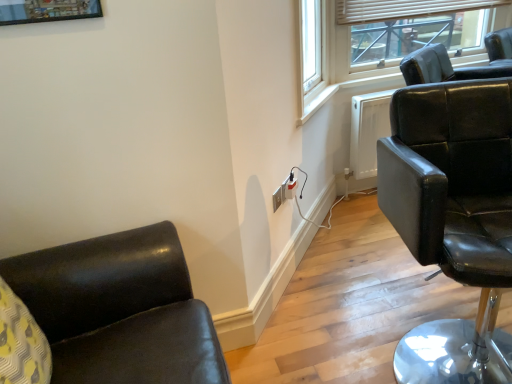
Find the location of `matte black chair at upper right`. matte black chair at upper right is located at coordinates (412, 29).

Describe the element at coordinates (412, 29) in the screenshot. I see `matte black chair at upper right` at that location.

In the scene shown: Measure the distance between matte black chair at right and camera.

A distance of 38.92 inches exists between matte black chair at right and camera.

Describe the element at coordinates (278, 197) in the screenshot. I see `white plastic outlet at center, the second electric outlet in the right-to-left sequence` at that location.

Identify the location of matte black chair at upper right. This screenshot has height=384, width=512. (412, 29).

Considering the positions of point (293, 196) and point (274, 205), is point (293, 196) closer or farther from the camera than point (274, 205)?

Point (293, 196) is positioned farther from the camera compared to point (274, 205).

From the image's perspective, is matte black socket at lower right, which is the 2th electric outlet in left-to-right order, located above or below white plastic outlet at center, the second electric outlet in the right-to-left sequence?

From the image's perspective, matte black socket at lower right, which is the 2th electric outlet in left-to-right order, appears above white plastic outlet at center, the second electric outlet in the right-to-left sequence.

Consider the image. Which object is further away from the camera taking this photo, matte black socket at lower right, which appears as the 1th electric outlet when viewed from the right, or white plastic outlet at center, the second electric outlet in the right-to-left sequence?

matte black socket at lower right, which appears as the 1th electric outlet when viewed from the right, is further away from the camera.

Considering the sizes of objects matte black socket at lower right, the 1th electric outlet positioned from the back, and white plastic outlet at center, which ranks as the first electric outlet in front-to-back order, in the image provided, who is thinner, matte black socket at lower right, the 1th electric outlet positioned from the back, or white plastic outlet at center, which ranks as the first electric outlet in front-to-back order,?

white plastic outlet at center, which ranks as the first electric outlet in front-to-back order, is thinner.

How different are the orientations of matte black chair at right and matte black chair at upper right in degrees?

18.1 degrees.

Where is `window screen above the matte black chair at right (from a real-world perspective)`? window screen above the matte black chair at right (from a real-world perspective) is located at coordinates (412, 29).

Which object is positioned more to the right, matte black chair at right or matte black chair at upper right?

Positioned to the right is matte black chair at upper right.

From the image's perspective, which object appears higher, matte black chair at right or matte black chair at upper right?

From the image's view, matte black chair at upper right is above.

Does white plastic outlet at center, which ranks as the first electric outlet in front-to-back order, appear on the right side of matte black chair at right?

In fact, white plastic outlet at center, which ranks as the first electric outlet in front-to-back order, is to the left of matte black chair at right.

How different are the orientations of white plastic outlet at center, the second electric outlet viewed from the back, and matte black chair at right in degrees?

70.6 degrees.

Which is farther, (280,200) or (425,165)?

The point (280,200) is more distant.

Considering the sizes of white plastic outlet at center, arranged as the 1th electric outlet when viewed from the left, and matte black chair at right in the image, is white plastic outlet at center, arranged as the 1th electric outlet when viewed from the left, bigger or smaller than matte black chair at right?

white plastic outlet at center, arranged as the 1th electric outlet when viewed from the left, is smaller than matte black chair at right.

Is matte black socket at lower right, the 1th electric outlet positioned from the back, closer to the viewer compared to matte black chair at upper right?

Yes.

From the image's perspective, which is above, matte black socket at lower right, the 1th electric outlet positioned from the back, or matte black chair at upper right?

matte black chair at upper right, from the image's perspective.

Between point (295, 195) and point (369, 48), which one is positioned in front?

Positioned in front is point (295, 195).

From the image's perspective, starting from the matte black chair at upper right, which electric outlet is the 1st one below? Please provide its 2D coordinates.

[(290, 187)]

Does matte black chair at upper right have a lesser height compared to white plastic outlet at center, the second electric outlet viewed from the back?

No.

Between matte black chair at upper right and white plastic outlet at center, arranged as the 1th electric outlet when viewed from the left, which one has larger size?

With larger size is matte black chair at upper right.

Would you consider matte black chair at upper right to be distant from white plastic outlet at center, arranged as the 1th electric outlet when viewed from the left?

Yes.

From a real-world perspective, does matte black chair at upper right sit lower than white plastic outlet at center, the second electric outlet in the right-to-left sequence?

No.

Which of these two, matte black socket at lower right, which appears as the 1th electric outlet when viewed from the right, or matte black chair at right, is smaller?

matte black socket at lower right, which appears as the 1th electric outlet when viewed from the right, is smaller.

From a real-world perspective, which object rests below the other?

matte black socket at lower right, which is the 2th electric outlet in left-to-right order.

From the image's perspective, starting from the matte black chair at right, which electric outlet is the 2nd one above? Please provide its 2D coordinates.

[(290, 187)]

Can you confirm if matte black socket at lower right, which appears as the 1th electric outlet when viewed from the right, is taller than matte black chair at right?

In fact, matte black socket at lower right, which appears as the 1th electric outlet when viewed from the right, may be shorter than matte black chair at right.

From a real-world perspective, who is located higher, matte black chair at upper right or matte black chair at right?

matte black chair at upper right.

Which of these two, matte black chair at upper right or matte black chair at right, is smaller?

matte black chair at upper right is smaller.

Image resolution: width=512 pixels, height=384 pixels. What are the coordinates of `chair that is under the matte black chair at upper right (from a real-world perspective)` in the screenshot? It's located at (453, 218).

This screenshot has width=512, height=384. In order to click on electric outlet located on the right of white plastic outlet at center, the second electric outlet in the right-to-left sequence in this screenshot , I will do pyautogui.click(x=290, y=187).

Image resolution: width=512 pixels, height=384 pixels. I want to click on chair below the matte black chair at upper right (from a real-world perspective), so click(x=453, y=218).

From the image, which object appears to be nearer to matte black chair at right, matte black socket at lower right, the 1th electric outlet positioned from the back, or white plastic outlet at center, which ranks as the first electric outlet in front-to-back order?

Based on the image, white plastic outlet at center, which ranks as the first electric outlet in front-to-back order, appears to be nearer to matte black chair at right.

Which object lies further to the anchor point matte black chair at right, white plastic outlet at center, which ranks as the first electric outlet in front-to-back order, or matte black chair at upper right?

Based on the image, matte black chair at upper right appears to be further to matte black chair at right.

Which object lies further to the anchor point white plastic outlet at center, arranged as the 1th electric outlet when viewed from the left, matte black chair at right or matte black chair at upper right?

The object further to white plastic outlet at center, arranged as the 1th electric outlet when viewed from the left, is matte black chair at upper right.

When comparing their distances from matte black socket at lower right, the 1th electric outlet positioned from the back, does matte black chair at upper right or white plastic outlet at center, which ranks as the first electric outlet in front-to-back order, seem closer?

Among the two, white plastic outlet at center, which ranks as the first electric outlet in front-to-back order, is located nearer to matte black socket at lower right, the 1th electric outlet positioned from the back.

When comparing their distances from matte black chair at right, does matte black socket at lower right, which is the 2th electric outlet in left-to-right order, or matte black chair at upper right seem closer?

matte black socket at lower right, which is the 2th electric outlet in left-to-right order, is positioned closer to the anchor matte black chair at right.

Estimate the real-world distances between objects in this image. Which object is further from matte black chair at upper right, matte black socket at lower right, which is the 2th electric outlet in left-to-right order, or white plastic outlet at center, which ranks as the first electric outlet in front-to-back order?

white plastic outlet at center, which ranks as the first electric outlet in front-to-back order.

From the image, which object appears to be farther from white plastic outlet at center, arranged as the 1th electric outlet when viewed from the left, matte black chair at right or matte black socket at lower right, which is the 2th electric outlet in left-to-right order?

The object further to white plastic outlet at center, arranged as the 1th electric outlet when viewed from the left, is matte black chair at right.

Based on the photo, considering their positions, is white plastic outlet at center, the second electric outlet in the right-to-left sequence, positioned closer to matte black chair at right than matte black socket at lower right, which appears as the 1th electric outlet when viewed from the right?

white plastic outlet at center, the second electric outlet in the right-to-left sequence, lies closer to matte black chair at right than the other object.

Locate an element on the screen. Image resolution: width=512 pixels, height=384 pixels. electric outlet between matte black chair at upper right and white plastic outlet at center, arranged as the 1th electric outlet when viewed from the left, vertically is located at coordinates (290, 187).

You are a GUI agent. You are given a task and a screenshot of the screen. Output one action in this format:
    pyautogui.click(x=<x>, y=<y>)
    Task: Click on the electric outlet between matte black chair at right and matte black socket at lower right, the 2th electric outlet viewed from the front, in the front-back direction
    
    Given the screenshot: What is the action you would take?
    pyautogui.click(x=278, y=197)